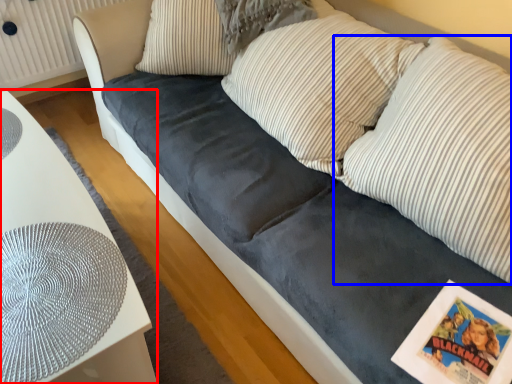
Question: Which of the following is the farthest to the observer, furniture (highlighted by a red box) or pillow (highlighted by a blue box)?

Choices:
 (A) furniture
 (B) pillow

Answer: (A)